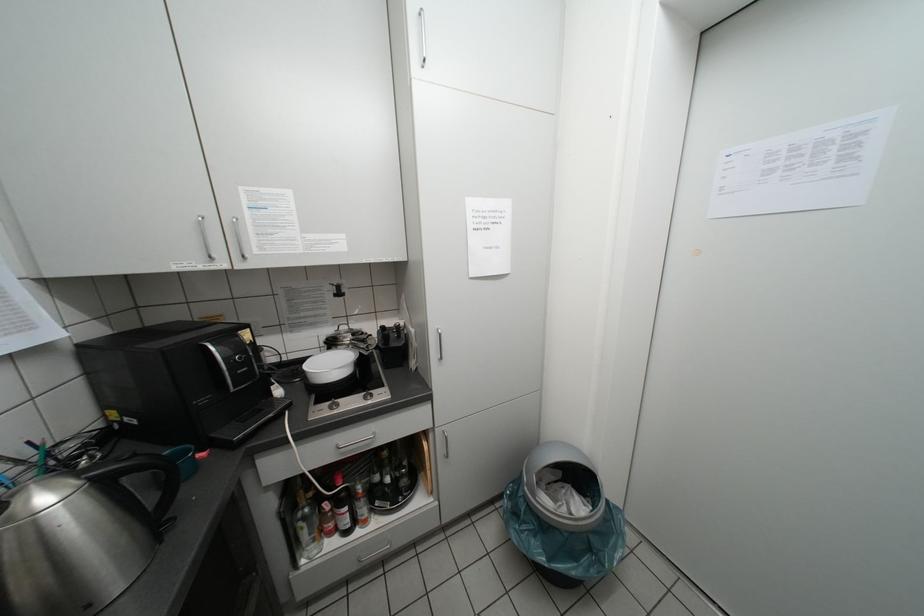
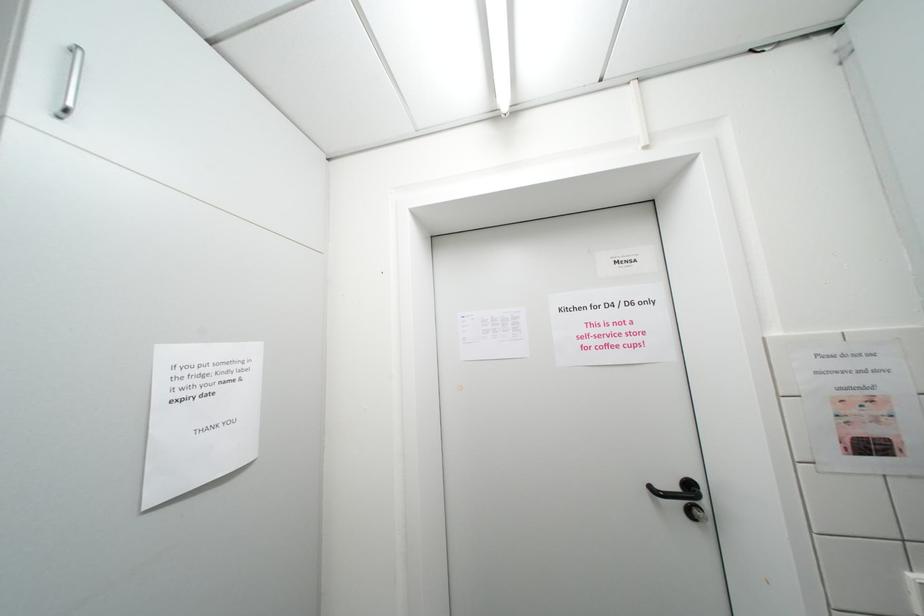
The first image is from the beginning of the video and the second image is from the end. How did the camera likely rotate when shooting the video?

The camera's rotation is toward right-up.